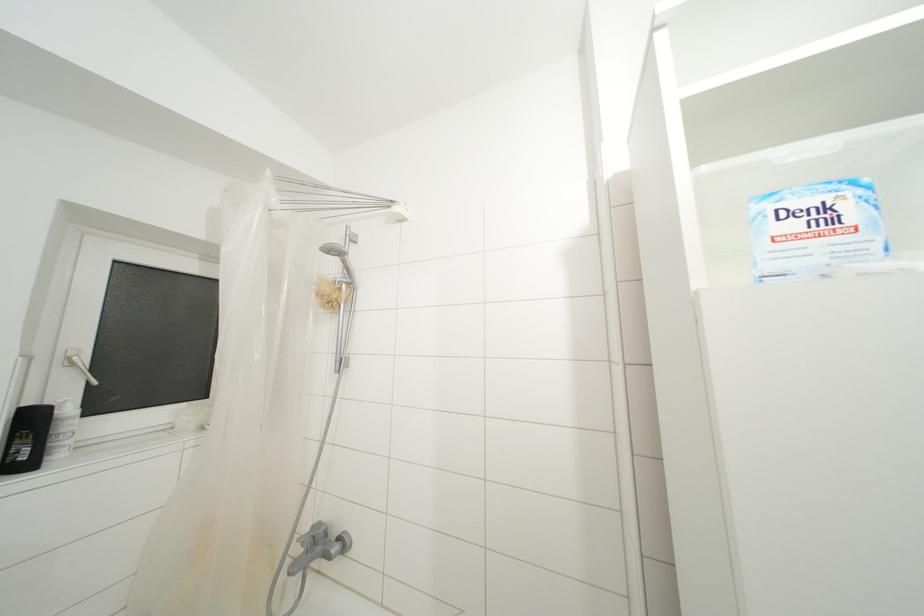
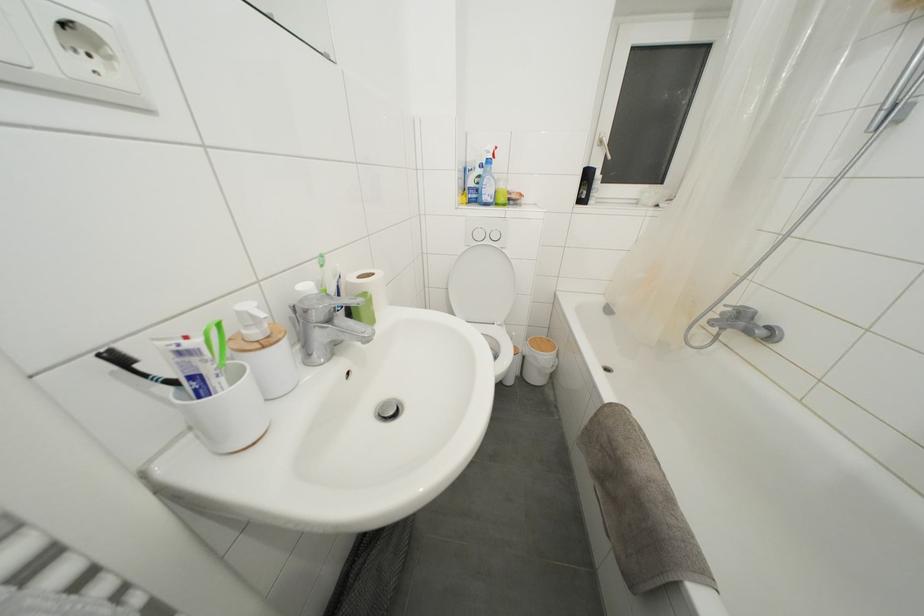
Locate, in the second image, the point that corresponds to point (307, 549) in the first image.

(726, 318)